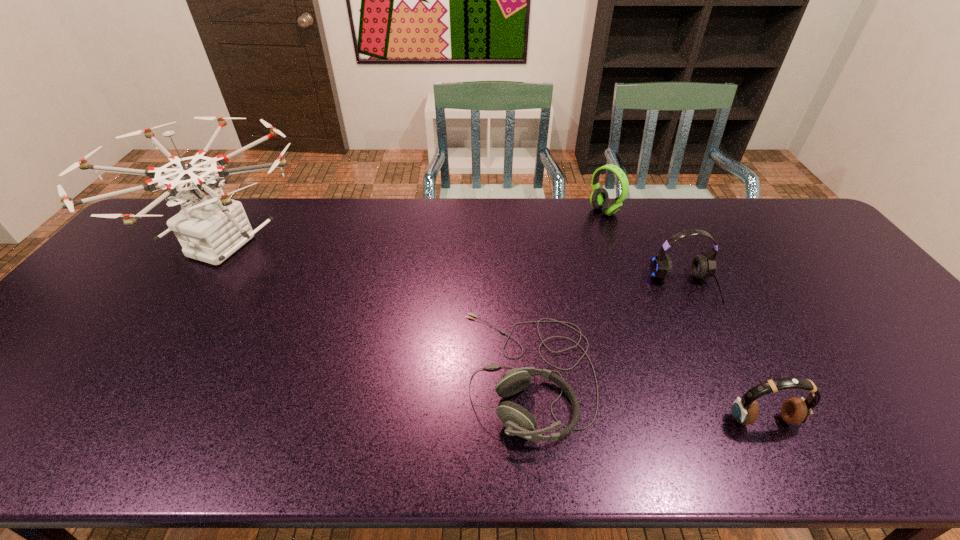
Where is `the leftmost object`? Image resolution: width=960 pixels, height=540 pixels. the leftmost object is located at coordinates (213, 227).

Identify the location of drone. The image size is (960, 540). (213, 227).

The width and height of the screenshot is (960, 540). Find the location of `the farthest headset`. the farthest headset is located at coordinates (599, 198).

You are a GUI agent. You are given a task and a screenshot of the screen. Output one action in this format:
    pyautogui.click(x=<x>, y=<y>)
    Task: Click on the third object from left to right
    Image resolution: width=960 pixels, height=540 pixels.
    Given the screenshot: What is the action you would take?
    pyautogui.click(x=599, y=198)

This screenshot has width=960, height=540. Find the location of `the third nearest headset`. the third nearest headset is located at coordinates (703, 266).

In order to click on the leftmost headset in this screenshot , I will do `click(517, 420)`.

I want to click on the second object from left to right, so click(x=517, y=420).

Where is `free space located 0.290m on the right of the drone`? Image resolution: width=960 pixels, height=540 pixels. free space located 0.290m on the right of the drone is located at coordinates (404, 246).

Locate an element on the screen. Image resolution: width=960 pixels, height=540 pixels. blank space located on the right of the farthest headset is located at coordinates (680, 211).

Locate an element on the screen. This screenshot has width=960, height=540. vacant point located on the ear cushions of the second farthest headset is located at coordinates (745, 415).